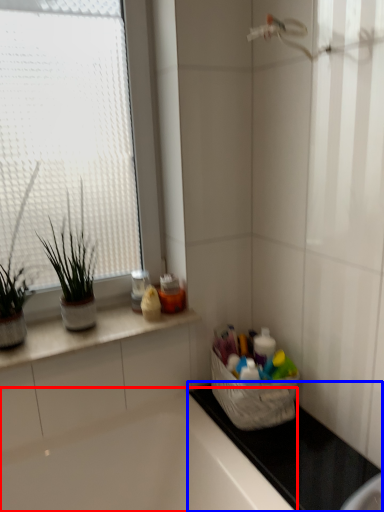
Question: Which object appears farthest to the camera in this image, bathtub (highlighted by a red box) or counter top (highlighted by a blue box)?

Choices:
 (A) bathtub
 (B) counter top

Answer: (B)